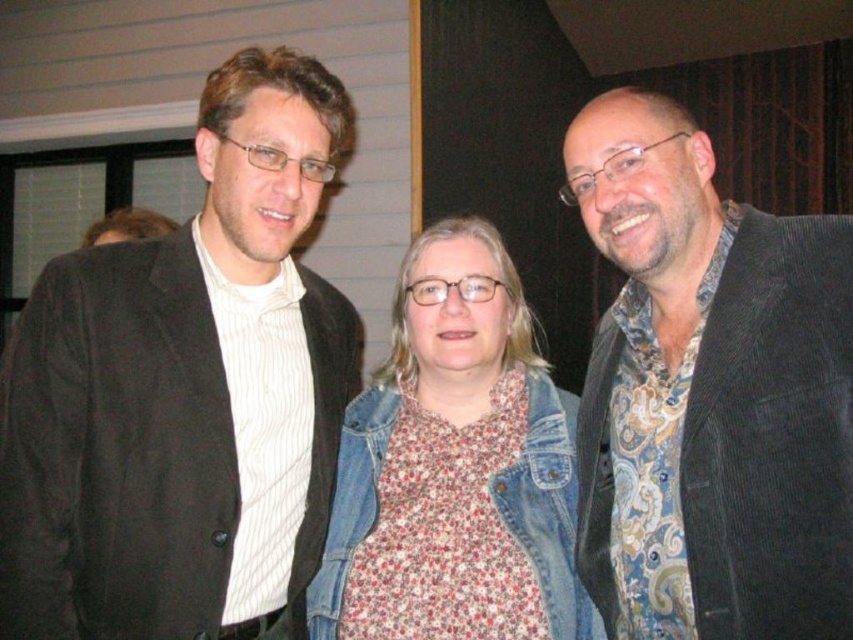
Question: Is matte black jacket at left closer to the viewer compared to denim jacket at center?

Choices:
 (A) no
 (B) yes

Answer: (B)

Question: Is paisley fabric shirt at right closer to the viewer compared to denim jacket at center?

Choices:
 (A) yes
 (B) no

Answer: (A)

Question: Which point is farther from the camera taking this photo?

Choices:
 (A) 425,454
 (B) 106,618

Answer: (A)

Question: Is matte black jacket at left to the right of paisley fabric shirt at right from the viewer's perspective?

Choices:
 (A) yes
 (B) no

Answer: (B)

Question: Which point is closer to the camera taking this photo?

Choices:
 (A) (442, 547)
 (B) (590, 152)

Answer: (B)

Question: Which of the following is the farthest from the observer?

Choices:
 (A) (628, 401)
 (B) (364, 438)

Answer: (B)